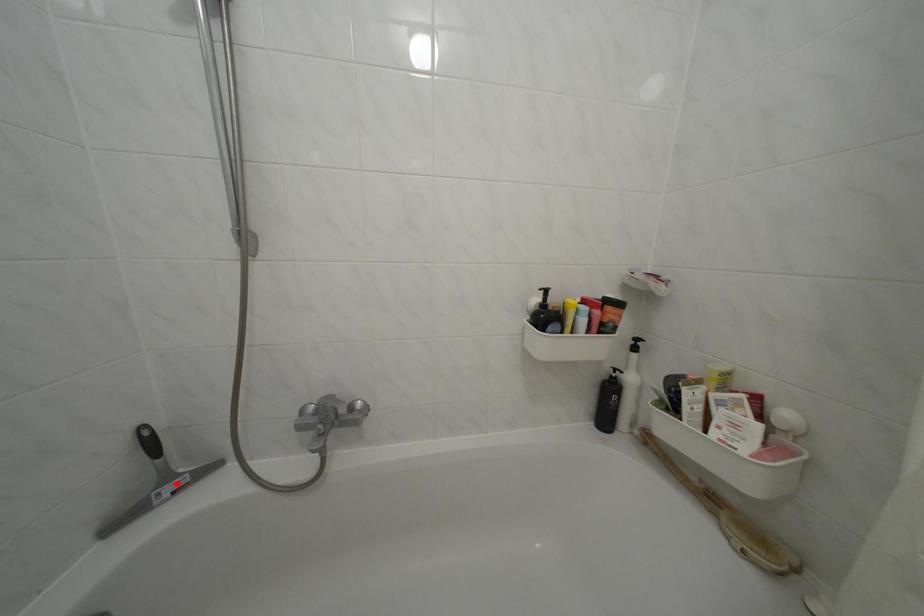
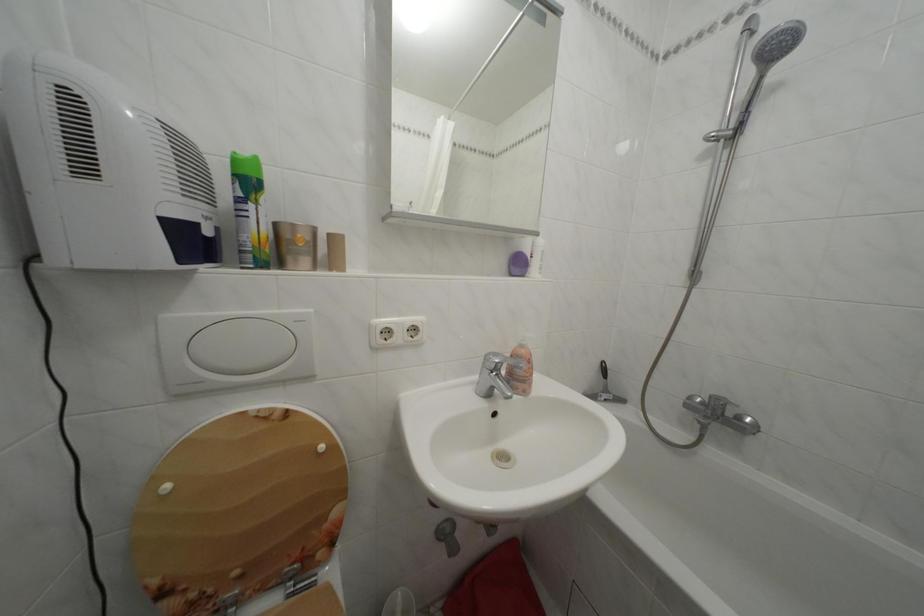
Question: I am providing you with two images of the same scene from different viewpoints. A red point is marked on the first image. At the location where the point appears in image 1, is it still visible in image 2?

Choices:
 (A) Yes
 (B) No

Answer: (A)